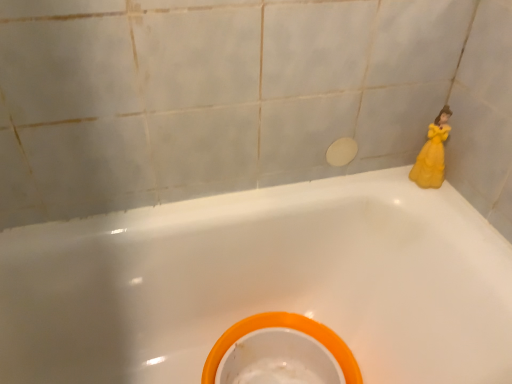
Based on the photo, what is the approximate height of white glossy bathtub at upper center?

22.34 inches.

Locate an element on the screen. This screenshot has height=384, width=512. white glossy bathtub at upper center is located at coordinates (262, 283).

The image size is (512, 384). What do you see at coordinates (262, 283) in the screenshot?
I see `white glossy bathtub at upper center` at bounding box center [262, 283].

Find the location of a particular element. The image size is (512, 384). white glossy bathtub at upper center is located at coordinates (262, 283).